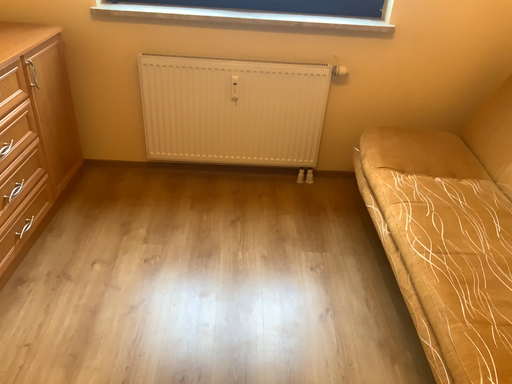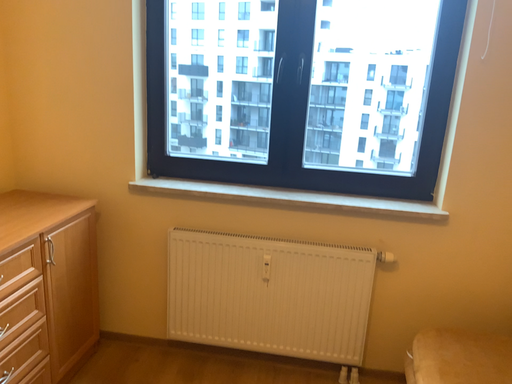
Question: How did the camera likely rotate when shooting the video?

Choices:
 (A) rotated left
 (B) rotated right

Answer: (A)